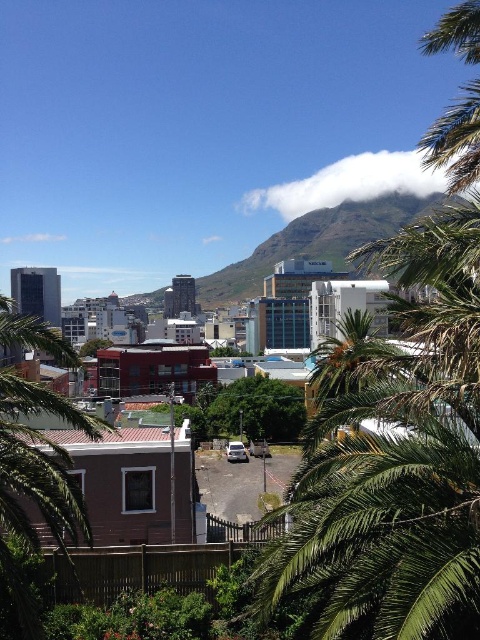
You are standing in the urban landscape and want to take a photo of the green grassy mountain at center and the white fluffy cloud at upper center. Which object should you adjust your camera to focus on first if you want both in the frame?

You should focus on the green grassy mountain at center first because it is to the left of the white fluffy cloud at upper center, so adjusting the camera to include the leftmost object first will help frame both.

You are an architect designing a new building that needs to fit between the green leafy palm tree at center and the white fluffy cloud at upper center. Which of the two objects has a narrower width to ensure the building doesn t block the view of the wider one?

The green leafy palm tree at center has a narrower width than the white fluffy cloud at upper center, so the building should be placed near the palm tree to avoid blocking the wider cloud.

You are a landscape photographer trying to capture the entire scene. You notice the green grassy mountain at center and the white fluffy cloud at upper center. Which object would appear larger in your photo?

The green grassy mountain at center would appear larger in the photo because it is bigger than the white fluffy cloud at upper center according to the description.